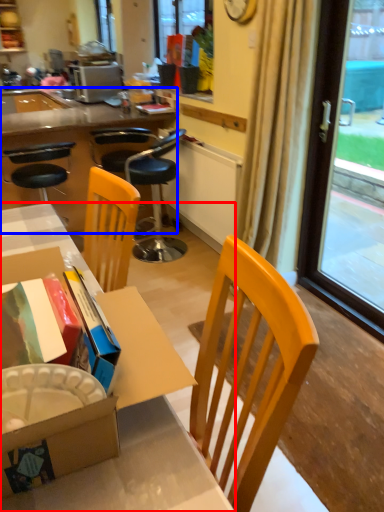
Question: Which of the following is the farthest to the observer, desk (highlighted by a red box) or desk (highlighted by a blue box)?

Choices:
 (A) desk
 (B) desk

Answer: (B)